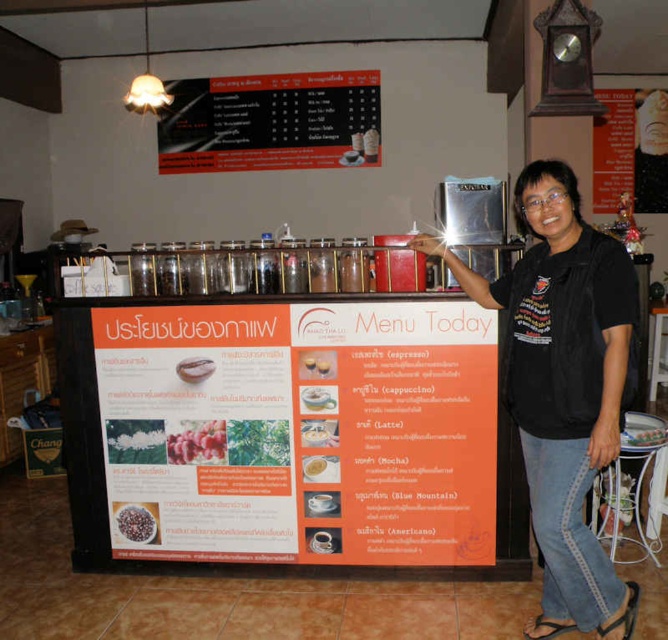
Is white creamy latte at center to the right of creamy yellow soup at center from the viewer's perspective?

Correct, you'll find white creamy latte at center to the right of creamy yellow soup at center.

The height and width of the screenshot is (640, 668). Find the location of `white creamy latte at center`. white creamy latte at center is located at coordinates (317, 433).

Based on the photo, is red matte coffee beans at center to the left of matte white plate at center from the viewer's perspective?

Indeed, red matte coffee beans at center is positioned on the left side of matte white plate at center.

Can you confirm if red matte coffee beans at center is positioned below matte white plate at center?

Correct, red matte coffee beans at center is located below matte white plate at center.

Which is behind, point (186, 451) or point (194, 381)?

Point (186, 451)

You are a GUI agent. You are given a task and a screenshot of the screen. Output one action in this format:
    pyautogui.click(x=<x>, y=<y>)
    Task: Click on the red matte coffee beans at center
    The width and height of the screenshot is (668, 640).
    Given the screenshot: What is the action you would take?
    pyautogui.click(x=196, y=442)

Does black matte shirt at center appear under brown matte beans at center?

Incorrect, black matte shirt at center is not positioned below brown matte beans at center.

Can you confirm if black matte shirt at center is thinner than brown matte beans at center?

No, black matte shirt at center is not thinner than brown matte beans at center.

Does point (556, 227) lie behind point (120, 515)?

No, (556, 227) is in front of (120, 515).

This screenshot has height=640, width=668. What are the coordinates of `black matte shirt at center` in the screenshot? It's located at (562, 387).